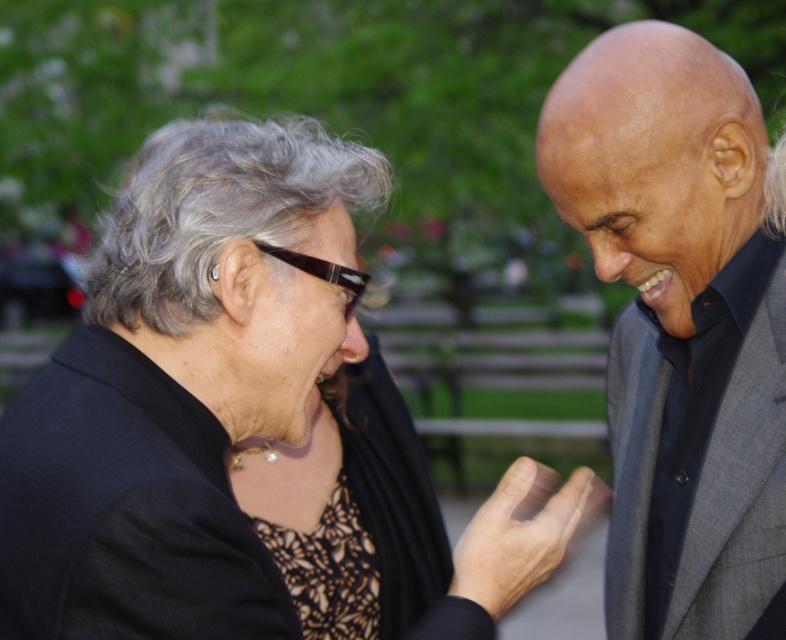
You are a tailor who needs to determine which suit requires more fabric to alter. You have two suits in front of you labeled as gray suit at right and gray wool business suit at right. Based on their sizes, which one would need more fabric for alterations?

The gray suit at right is bigger than the gray wool business suit at right, so it would require more fabric for alterations.

You are a photographer adjusting your camera settings to focus on the gray suit at right and the gray wool business suit at right. Which one should you focus on first to ensure proper depth of field?

You should focus on the gray suit at right first because it is closer to the camera than the gray wool business suit at right, ensuring proper depth of field.